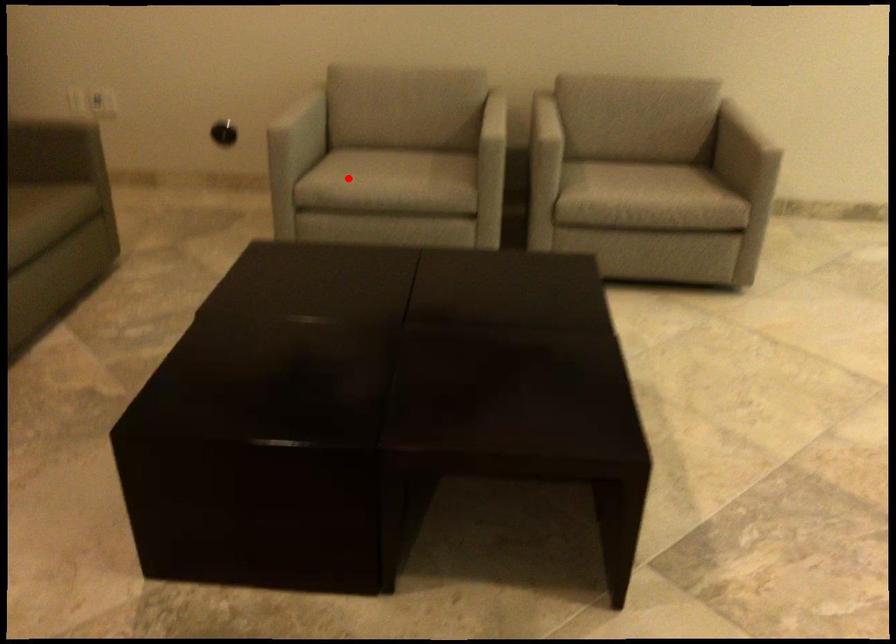
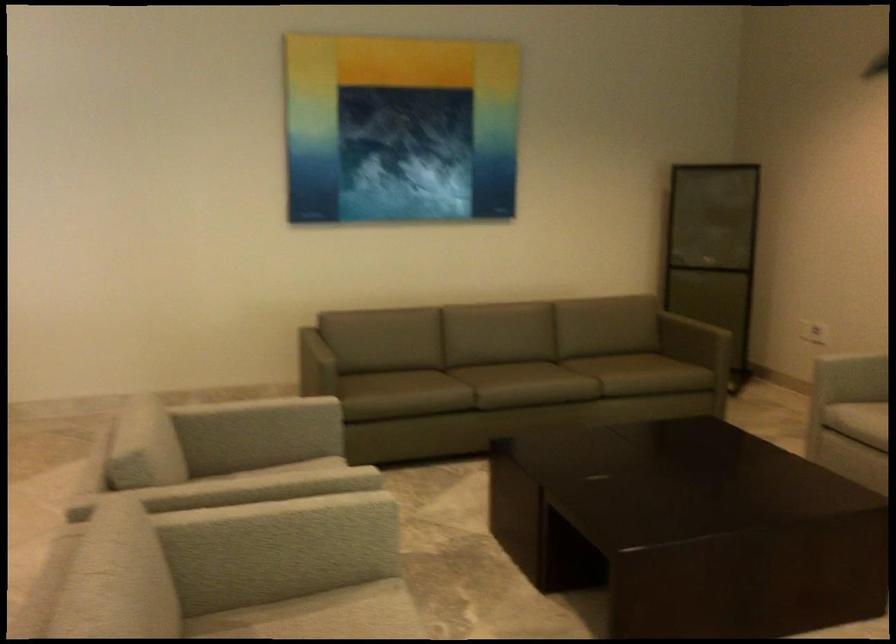
Find the pixel in the second image that matches the highlighted location in the first image.

(857, 420)